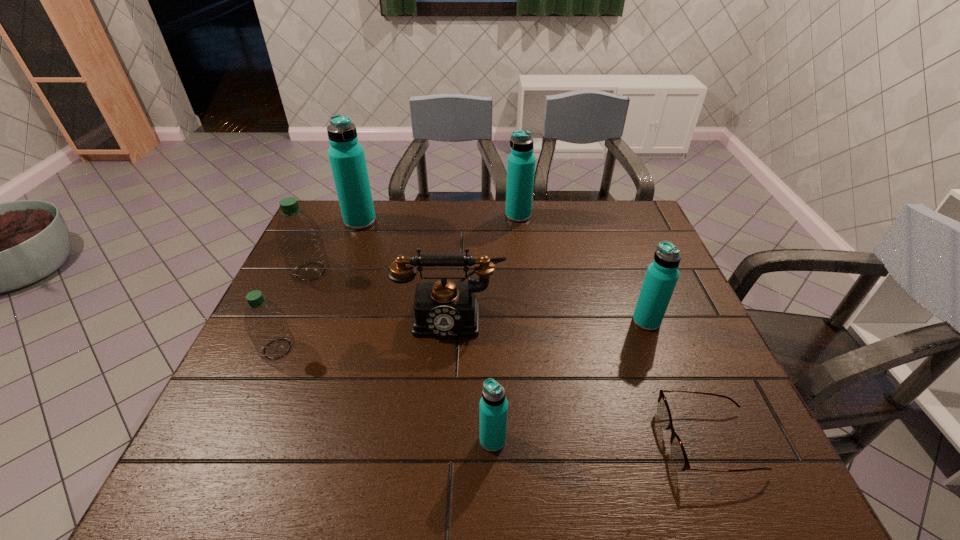
What are the coordinates of `the biggest blue water bottle` in the screenshot? It's located at (346, 156).

Locate an element on the screen. Image resolution: width=960 pixels, height=540 pixels. the tallest water bottle is located at coordinates click(346, 156).

You are a GUI agent. You are given a task and a screenshot of the screen. Output one action in this format:
    pyautogui.click(x=<x>, y=<y>)
    Task: Click on the fifth shortest water bottle
    The width and height of the screenshot is (960, 540).
    Given the screenshot: What is the action you would take?
    pyautogui.click(x=521, y=162)

Identify the location of the third object from right to left. (521, 162).

This screenshot has height=540, width=960. In order to click on the second smallest blue water bottle in this screenshot , I will do pyautogui.click(x=662, y=274).

You are a GUI agent. You are given a task and a screenshot of the screen. Output one action in this format:
    pyautogui.click(x=<x>, y=<y>)
    Task: Click on the third farthest blue water bottle
    
    Given the screenshot: What is the action you would take?
    pyautogui.click(x=662, y=274)

The width and height of the screenshot is (960, 540). Find the location of `the sixth nearest object`. the sixth nearest object is located at coordinates (299, 238).

Locate an element on the screen. the farther green water bottle is located at coordinates click(299, 238).

Find the location of a particular element. The image size is (960, 540). gray telephone is located at coordinates (444, 308).

The width and height of the screenshot is (960, 540). I want to click on the smallest blue water bottle, so click(x=493, y=408).